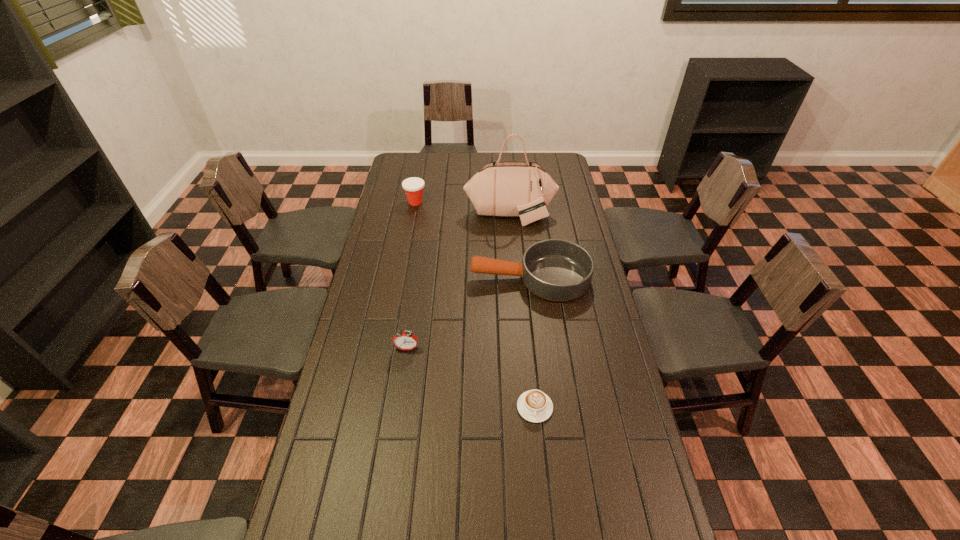
The height and width of the screenshot is (540, 960). What are the coordinates of `free point located 0.250m on the handle side of the third farthest object` in the screenshot? It's located at (406, 278).

I want to click on free space located on the clock face of the fourth farthest object, so [x=396, y=416].

At what (x,y) coordinates should I click in order to perform the action: click on vacant space located with the handle on the right side of the cappuccino. Please return your answer as a coordinate pair (x, y). This screenshot has height=540, width=960. Looking at the image, I should click on (542, 480).

In order to click on object that is at the left edge in this screenshot , I will do `click(413, 186)`.

The height and width of the screenshot is (540, 960). In order to click on handbag located at the right edge in this screenshot , I will do `click(524, 189)`.

Identify the location of pan at the right edge. pos(558,270).

What are the coordinates of `vacant space at the far edge of the desktop` in the screenshot? It's located at (454, 161).

Find the location of `vacant area at the left edge of the desktop`. vacant area at the left edge of the desktop is located at coordinates (396, 262).

Locate an element on the screen. vacant space at the right edge of the desktop is located at coordinates (566, 339).

This screenshot has height=540, width=960. In the image, there is a desktop. In order to click on blank space at the far left corner in this screenshot , I will do `click(427, 154)`.